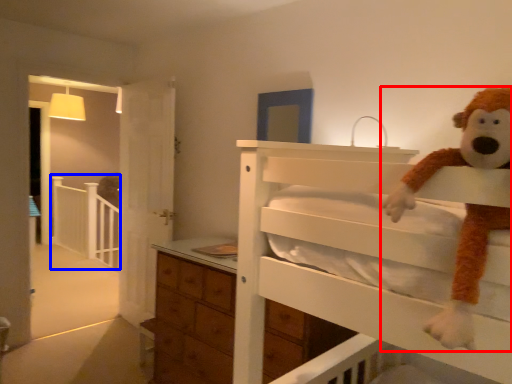
Question: Among these objects, which one is farthest to the camera, toy (highlighted by a red box) or balustrade (highlighted by a blue box)?

Choices:
 (A) toy
 (B) balustrade

Answer: (B)